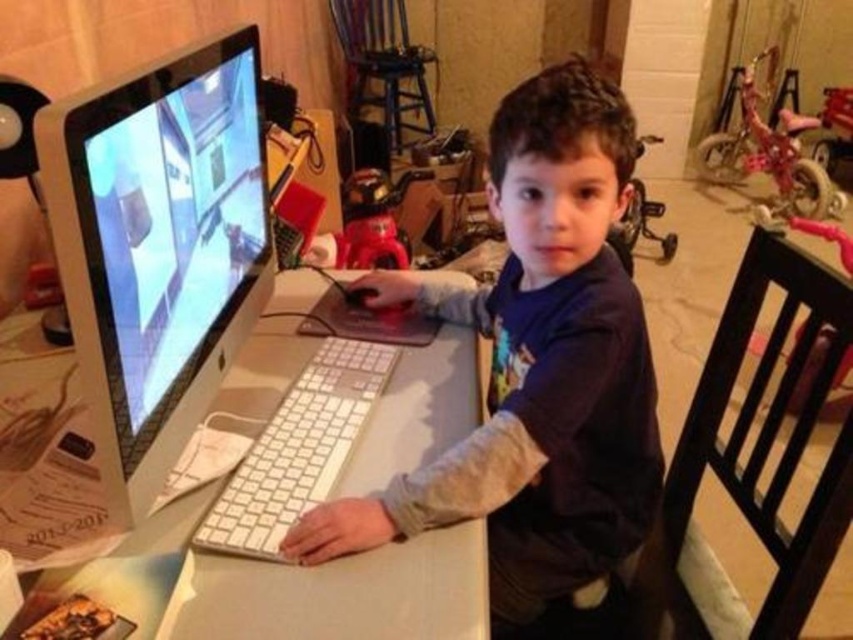
Looking at this image, between white plastic monitor at center and white plastic computer desk at center, which one has less height?

Standing shorter between the two is white plastic computer desk at center.

Which is behind, point (134, 504) or point (437, 449)?

Point (437, 449)

This screenshot has width=853, height=640. In order to click on white plastic monitor at center in this screenshot , I will do `click(160, 243)`.

Does point (614, 358) lie behind point (136, 506)?

Yes.

Does matte white shirt at center have a larger size compared to white plastic monitor at center?

Correct, matte white shirt at center is larger in size than white plastic monitor at center.

Does point (492, 362) lie in front of point (158, 460)?

No, (492, 362) is behind (158, 460).

What are the coordinates of `matte white shirt at center` in the screenshot? It's located at (535, 365).

Between matte white shirt at center and white plastic computer desk at center, which one appears on the left side from the viewer's perspective?

white plastic computer desk at center is more to the left.

Does point (599, 241) lie behind point (305, 595)?

Yes, it is behind point (305, 595).

Where is `matte white shirt at center`? matte white shirt at center is located at coordinates (535, 365).